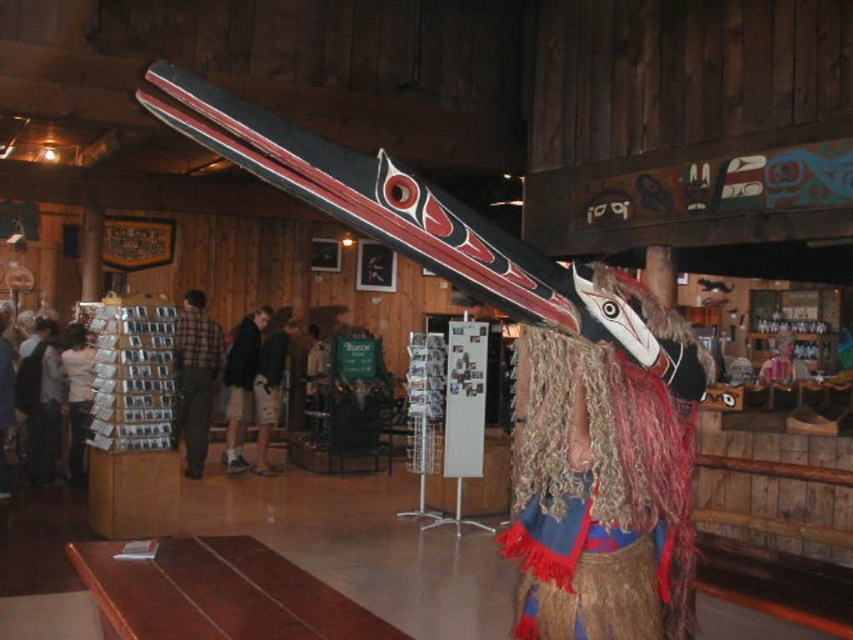
Question: Based on their relative distances, which object is farther from the carved wooden mask at center?

Choices:
 (A) pink fabric at lower right
 (B) dark blue jacket at center

Answer: (B)

Question: Does plaid fabric shirt at left appear on the left side of dark blue jacket at center?

Choices:
 (A) yes
 (B) no

Answer: (A)

Question: Does carved wooden mask at center appear on the left side of dark blue jacket at center?

Choices:
 (A) yes
 (B) no

Answer: (B)

Question: Which point is closer to the camera?

Choices:
 (A) (706, 365)
 (B) (68, 324)
 (C) (784, 330)
 (D) (193, 324)

Answer: (A)

Question: Can you confirm if plaid fabric shirt at left is bigger than matte black jacket at center?

Choices:
 (A) no
 (B) yes

Answer: (A)

Question: Which object is closer to the camera taking this photo?

Choices:
 (A) matte black jacket at center
 (B) carved wooden mask at center
 (C) plaid fabric shirt at left
 (D) white paper stack at left

Answer: (B)